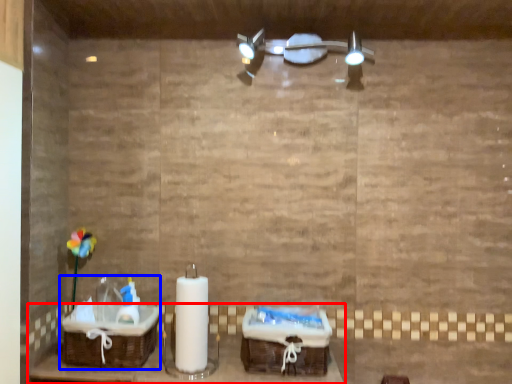
Question: Which object appears farthest to the camera in this image, furniture (highlighted by a red box) or sink (highlighted by a blue box)?

Choices:
 (A) furniture
 (B) sink

Answer: (B)